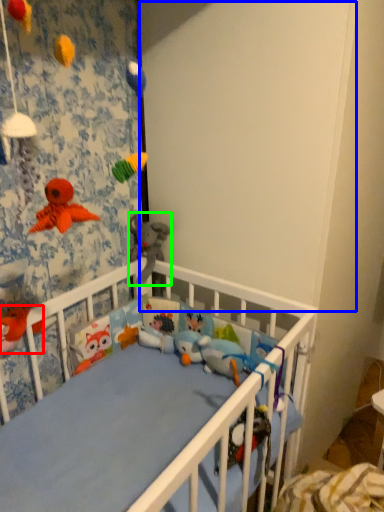
Question: Based on their relative distances, which object is nearer to toy (highlighted by a red box)? Choose from backdrop (highlighted by a blue box) and toy (highlighted by a green box).

Choices:
 (A) backdrop
 (B) toy

Answer: (B)